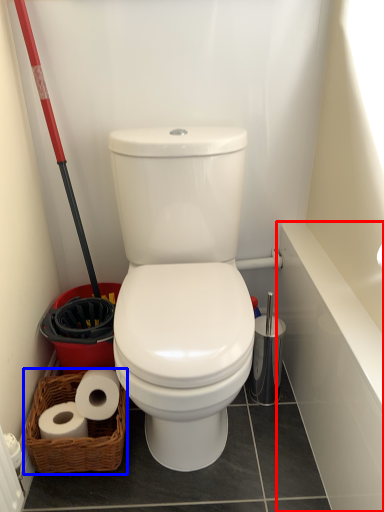
Question: Which point is further to the camera, bath (highlighted by a red box) or basket (highlighted by a blue box)?

Choices:
 (A) bath
 (B) basket

Answer: (B)